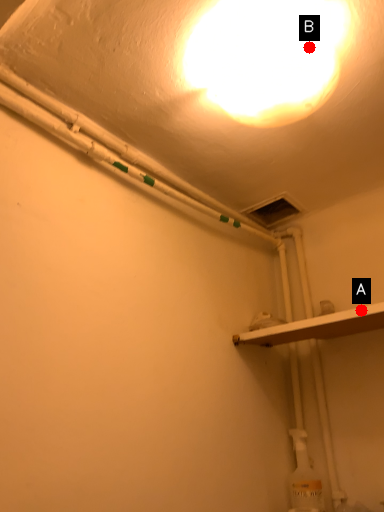
Question: Two points are circled on the image, labeled by A and B beside each circle. Which point is closer to the camera taking this photo?

Choices:
 (A) A is closer
 (B) B is closer

Answer: (B)